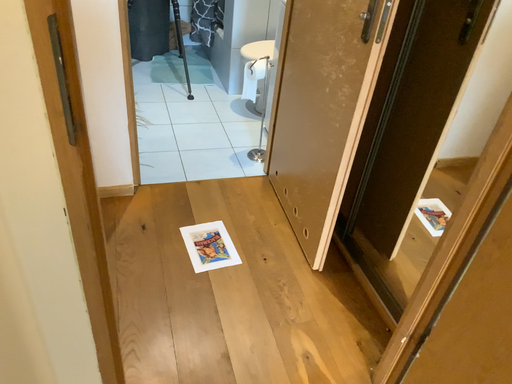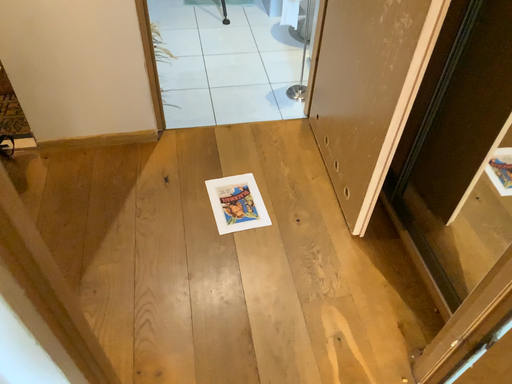
Question: Which way did the camera rotate in the video?

Choices:
 (A) rotated upward
 (B) rotated downward

Answer: (B)